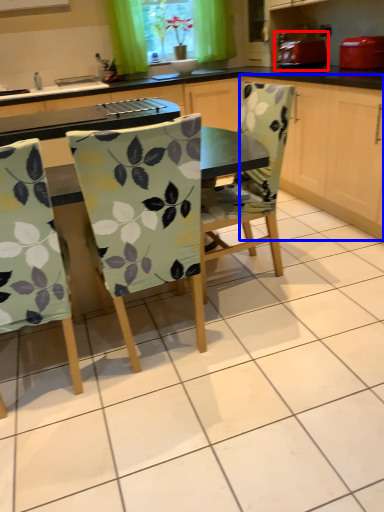
Question: Which object is closer to the camera taking this photo, appliance (highlighted by a red box) or cabinetry (highlighted by a blue box)?

Choices:
 (A) appliance
 (B) cabinetry

Answer: (B)